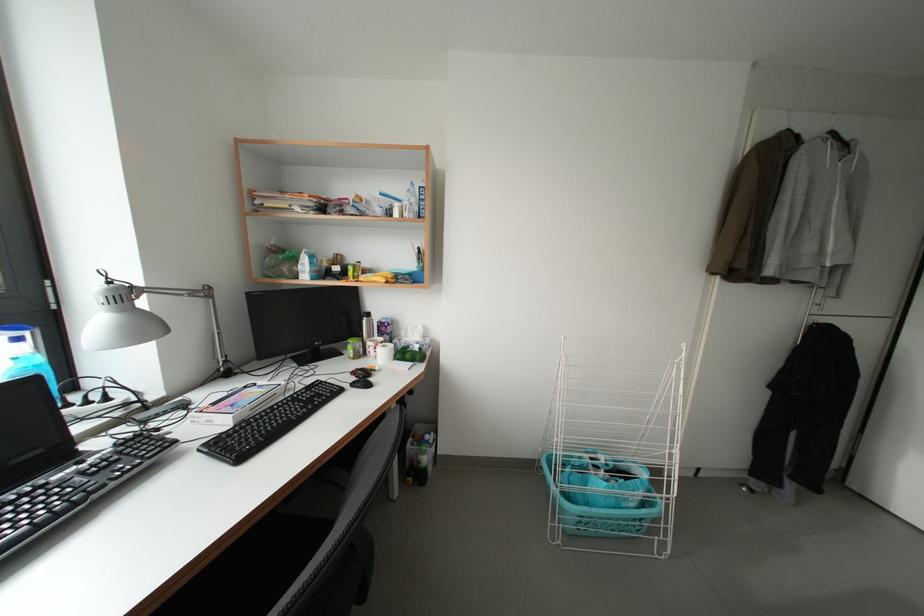
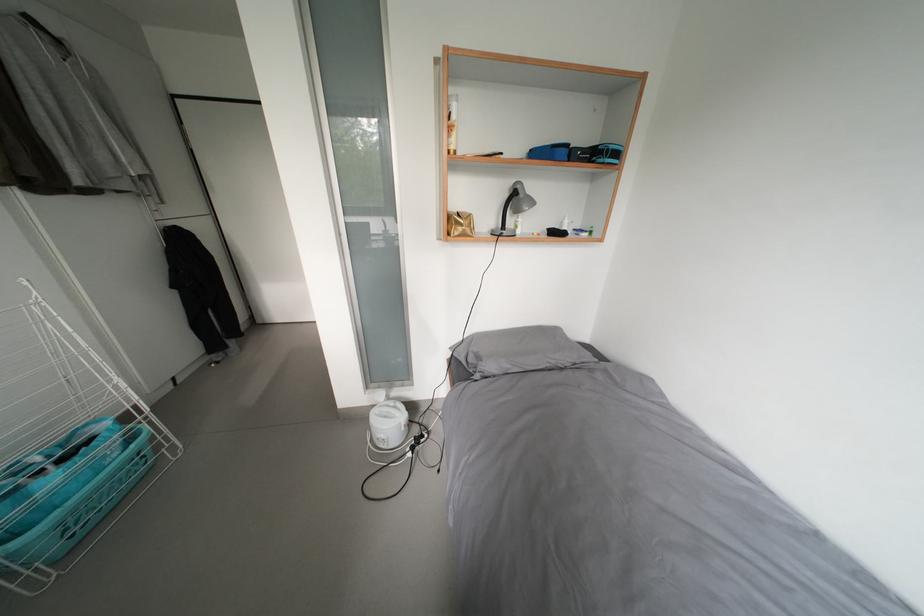
Where in the second image is the point corresponding to pixel 650 516 from the first image?

(140, 451)